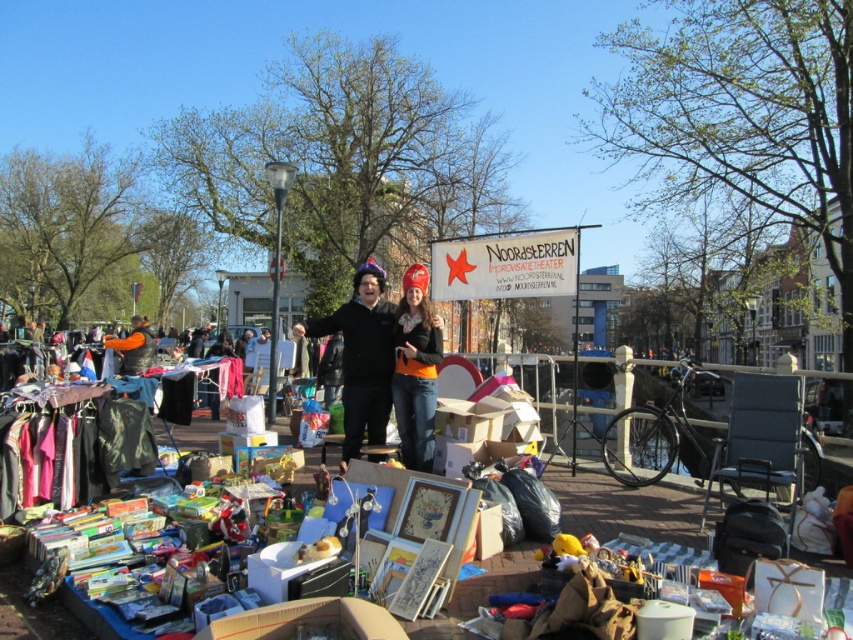
Between orange fabric pants at center and orange fleece vest at center, which one appears on the left side from the viewer's perspective?

From the viewer's perspective, orange fleece vest at center appears more on the left side.

Who is more distant from viewer, (419, 385) or (148, 342)?

Positioned behind is point (148, 342).

At what (x,y) coordinates should I click in order to perform the action: click on orange fabric pants at center. Please return your answer as a coordinate pair (x, y). This screenshot has width=853, height=640. Looking at the image, I should click on (416, 381).

Between black cotton hoodie at center and orange fabric pants at center, which one has less height?

Standing shorter between the two is orange fabric pants at center.

Does point (363, 321) come farther from viewer compared to point (427, 342)?

Yes, it is.

Who is more forward, (367,358) or (408,387)?

Positioned in front is point (367,358).

Locate an element on the screen. This screenshot has width=853, height=640. black cotton hoodie at center is located at coordinates (363, 368).

In the scene shown: Which of these two, black cotton hoodie at center or orange fleece vest at center, stands taller?

With more height is black cotton hoodie at center.

Does black cotton hoodie at center have a greater width compared to orange fleece vest at center?

Incorrect, black cotton hoodie at center's width does not surpass orange fleece vest at center's.

Locate an element on the screen. black cotton hoodie at center is located at coordinates (363, 368).